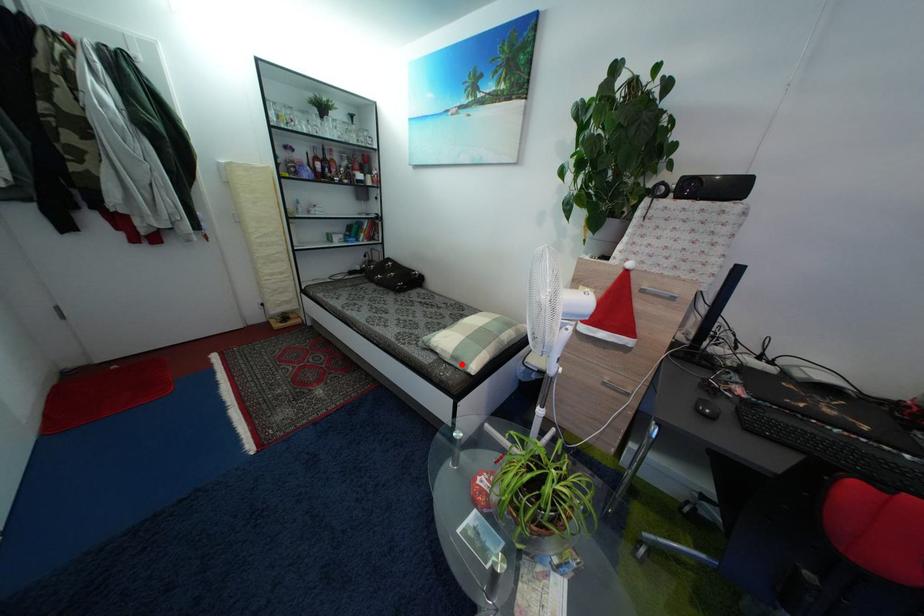
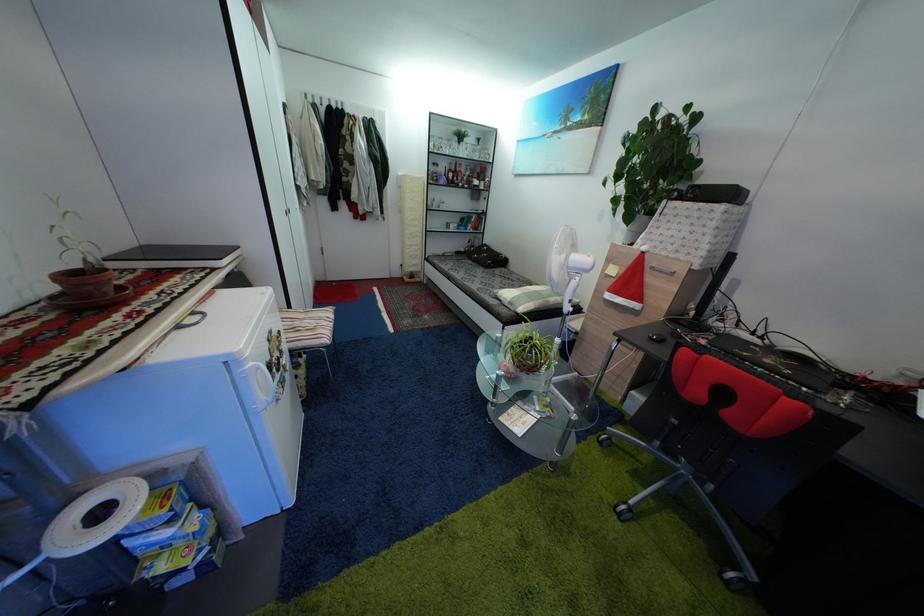
Find the pixel in the second image that matches the highlighted location in the first image.

(517, 310)